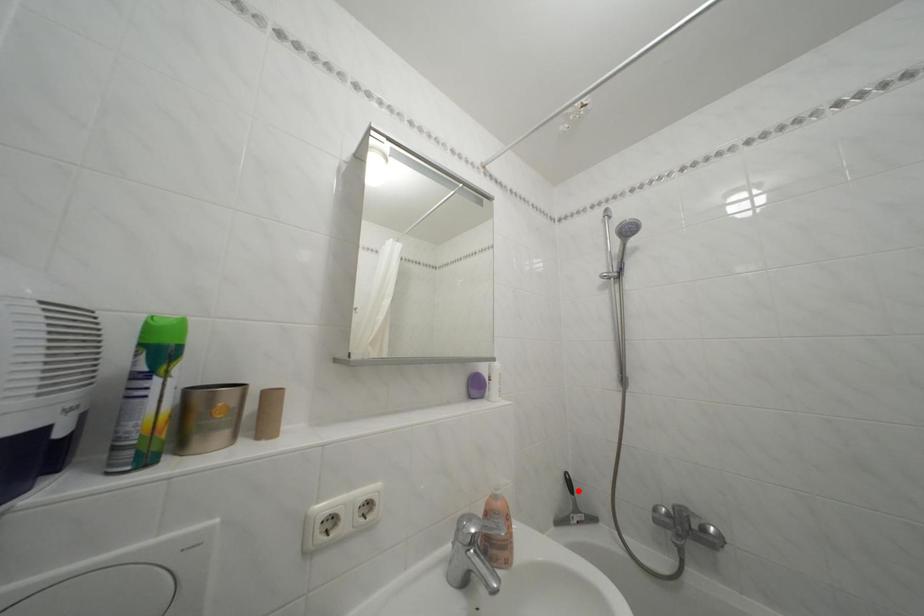
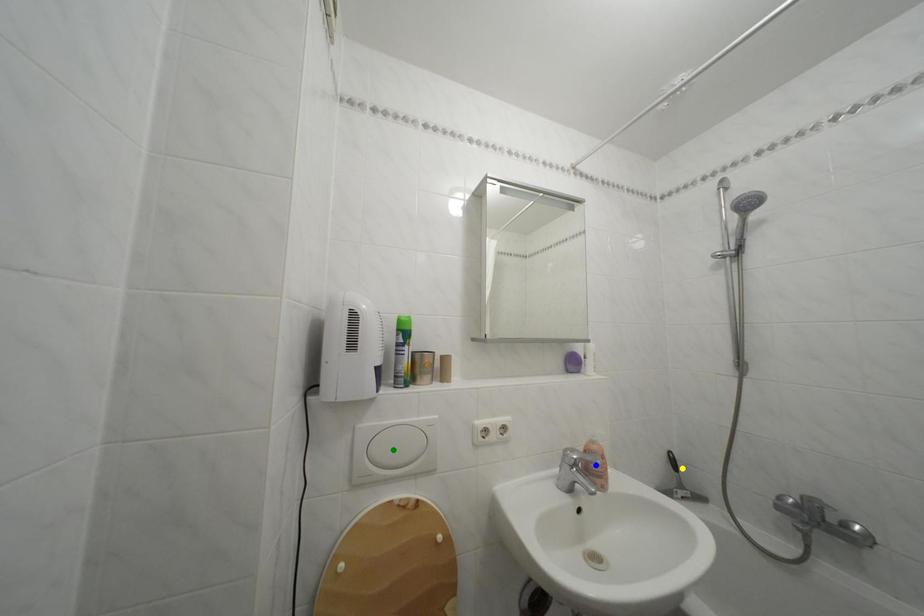
Question: I am providing you with two images of the same scene from different viewpoints. A red point is marked on the first image. You are given multiple points on the second image. Which point in image 2 represents the same 3d spot as the red point in image 1?

Choices:
 (A) green point
 (B) blue point
 (C) yellow point

Answer: (C)